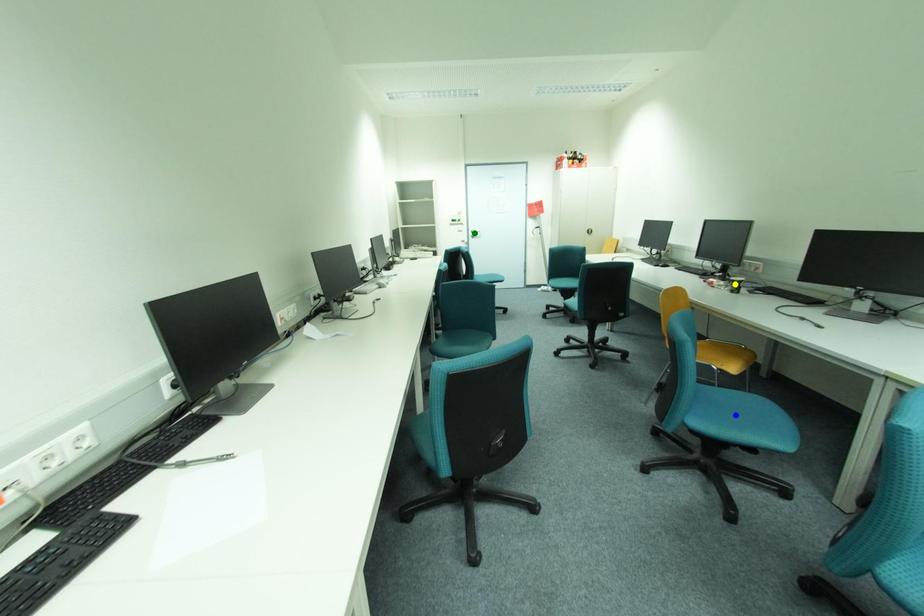
Order these from nearest to farthest:
green point | blue point | yellow point

1. green point
2. yellow point
3. blue point